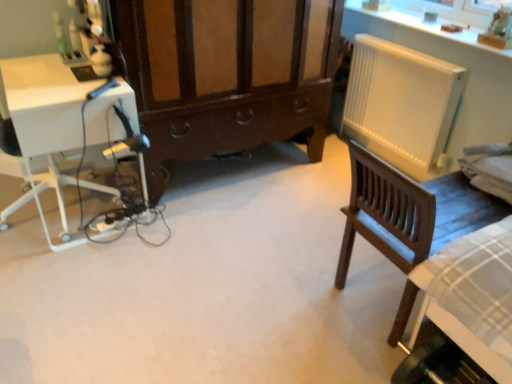
Where is `free space above white plastic radiator at right (from a real-world perspective)`? This screenshot has height=384, width=512. free space above white plastic radiator at right (from a real-world perspective) is located at coordinates (406, 51).